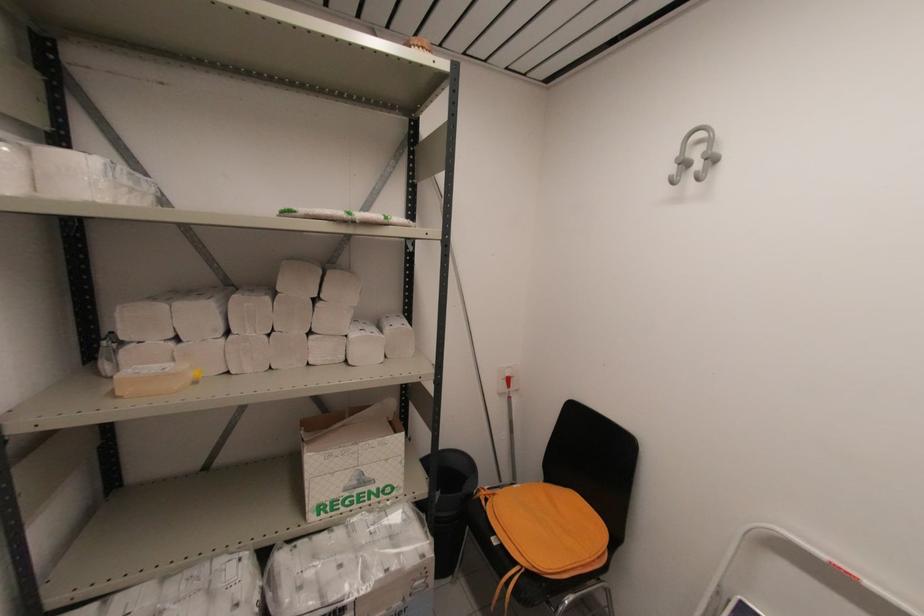
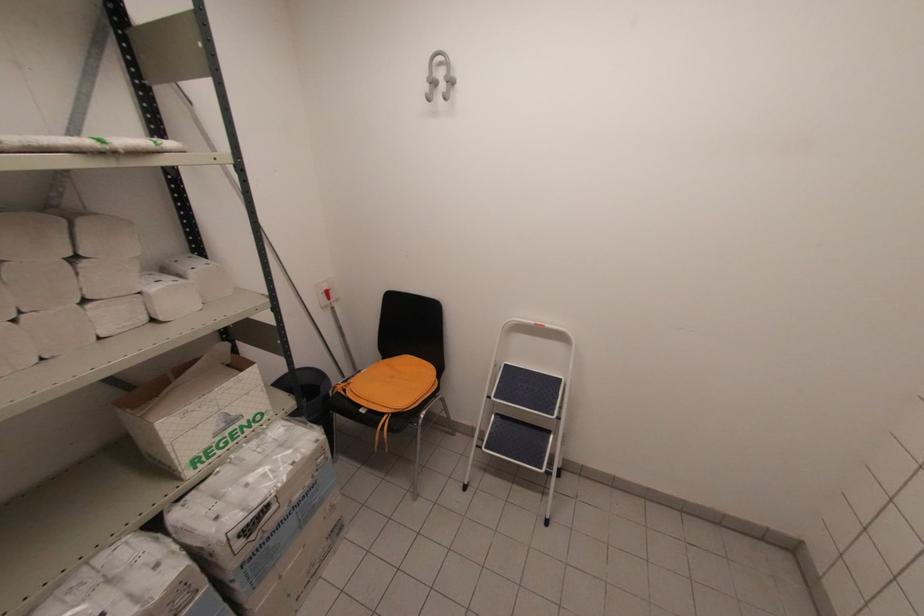
Locate, in the second image, the point that corresponds to [322,297] in the first image.

(81, 254)